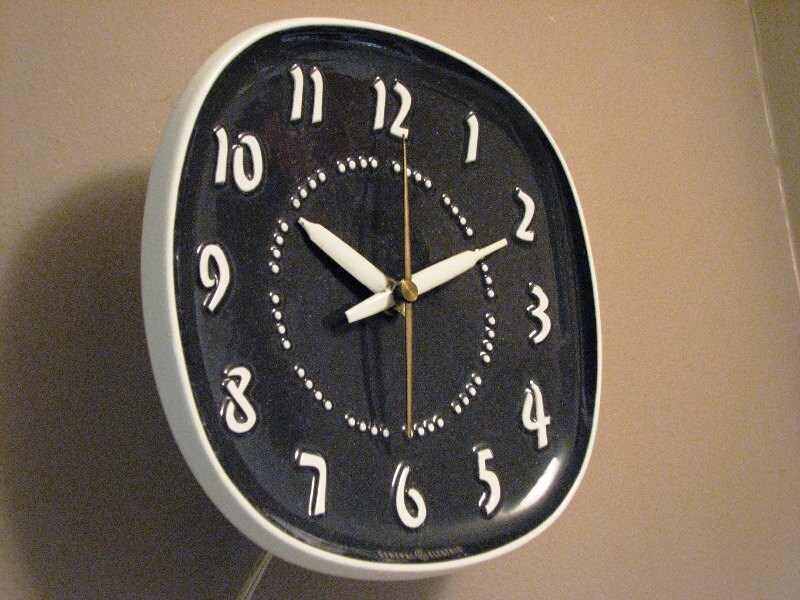
Locate an element on the screen. cable is located at coordinates (252, 589).